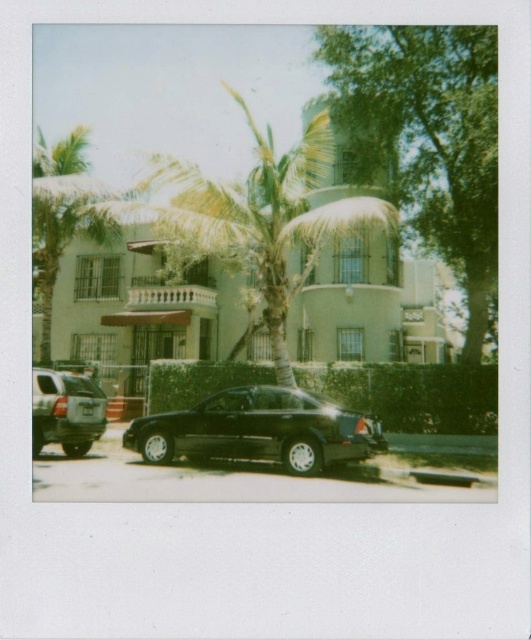
Is black matte car at center below matte black suv at lower left?

Yes.

Does black matte car at center have a greater height compared to matte black suv at lower left?

Incorrect, black matte car at center's height is not larger of matte black suv at lower left's.

Locate an element on the screen. black matte car at center is located at coordinates (260, 429).

You are a GUI agent. You are given a task and a screenshot of the screen. Output one action in this format:
    pyautogui.click(x=<x>, y=<y>)
    Task: Click on the black matte car at center
    The width and height of the screenshot is (531, 640).
    Given the screenshot: What is the action you would take?
    pyautogui.click(x=260, y=429)

Who is lower down, green leafy tree at upper right or black matte car at center?

black matte car at center

Is green leafy tree at upper right to the right of black matte car at center from the viewer's perspective?

Correct, you'll find green leafy tree at upper right to the right of black matte car at center.

Which is behind, point (481, 198) or point (229, 428)?

Positioned behind is point (481, 198).

Locate an element on the screen. green leafy tree at upper right is located at coordinates (425, 140).

Between point (162, 307) and point (346, 83), which one is positioned in front?

Point (346, 83) is more forward.

Is point (212, 328) farther from viewer compared to point (496, 225)?

That is True.

The width and height of the screenshot is (531, 640). What do you see at coordinates (156, 296) in the screenshot?
I see `beige stucco building at center` at bounding box center [156, 296].

The image size is (531, 640). I want to click on beige stucco building at center, so [x=156, y=296].